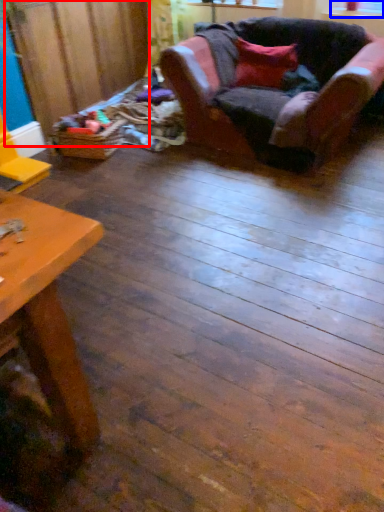
Question: Which point is closer to the camera, plywood (highlighted by a red box) or window screen (highlighted by a blue box)?

Choices:
 (A) plywood
 (B) window screen

Answer: (A)